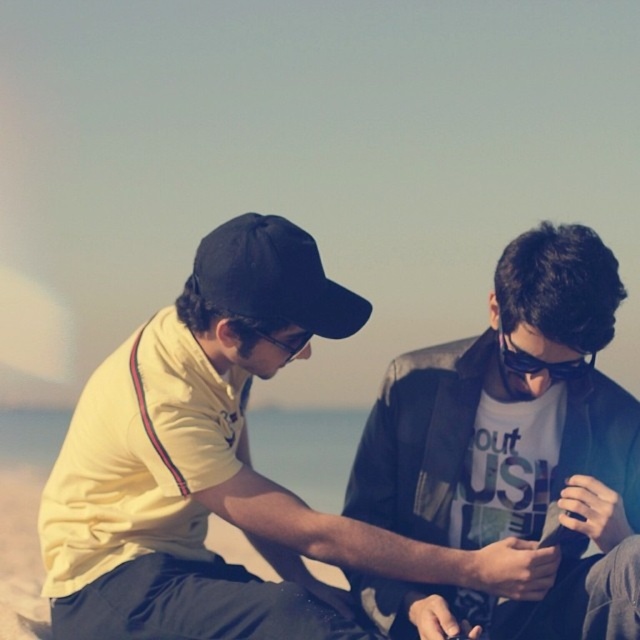
You are standing in front of the two people in the image. Which of the two points, point (196, 540) or point (262, 296), is closer to you?

Point (196, 540) is closer to you because it is further to the viewer than point (262, 296).

You are trying to decide which shirt to wear for a casual day out. Both the yellow fabric shirt at center and the matte black shirt at center are options. Based on their sizes, which one would you choose if you prefer a more oversized look?

The yellow fabric shirt at center is bigger than the matte black shirt at center, so if you prefer a more oversized look, you should choose the yellow fabric shirt at center.

What is the color of the shirt at the point marked as coordinates (512, 451)?

The color of the shirt at the point marked as coordinates (512, 451) is matte black.